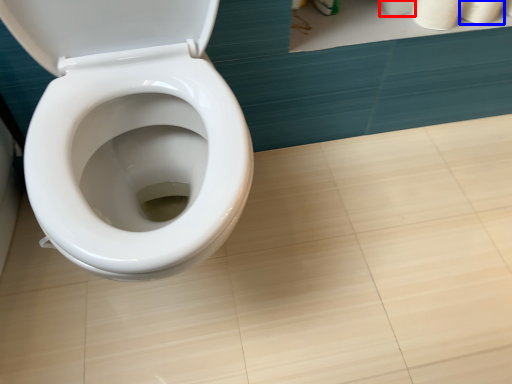
Question: Which object appears farthest to the camera in this image, toilet paper (highlighted by a red box) or toilet paper (highlighted by a blue box)?

Choices:
 (A) toilet paper
 (B) toilet paper

Answer: (A)